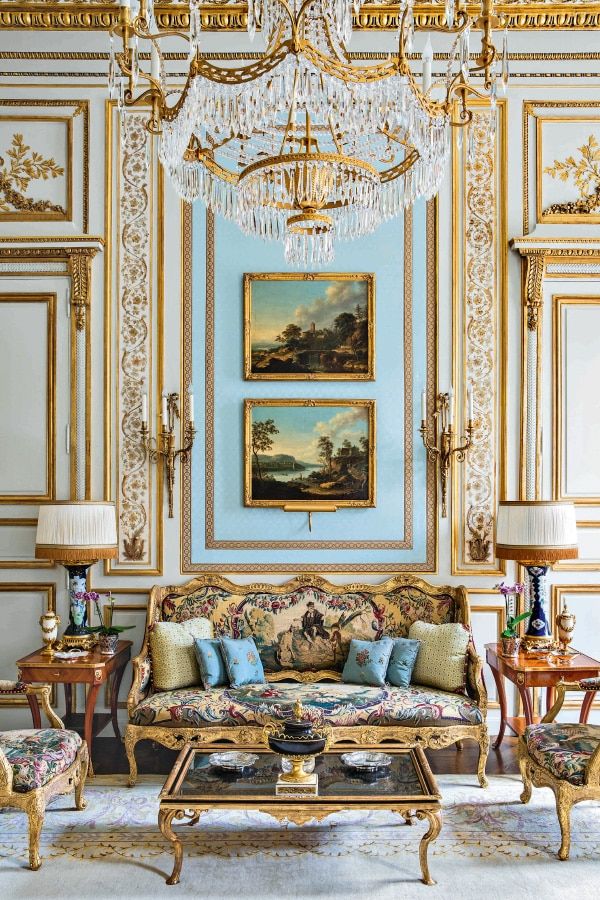
Locate an element on the screen. ash trays is located at coordinates (238, 759), (373, 757).